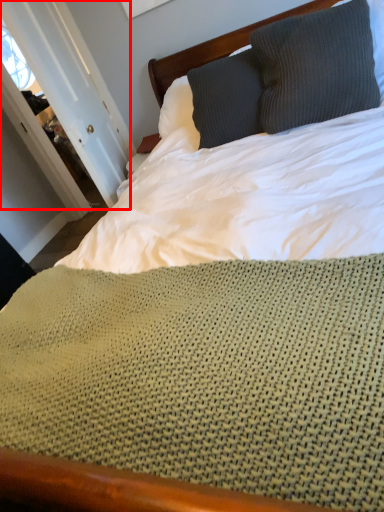
Question: From the image's perspective, where is door (annotated by the red box) located relative to pillow?

Choices:
 (A) above
 (B) below

Answer: (B)